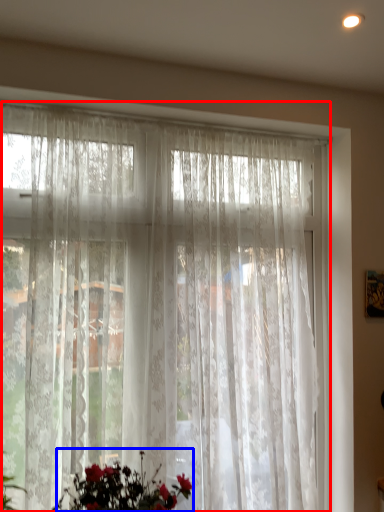
Question: Which object is closer to the camera taking this photo, curtain (highlighted by a red box) or floral arrangement (highlighted by a blue box)?

Choices:
 (A) curtain
 (B) floral arrangement

Answer: (B)